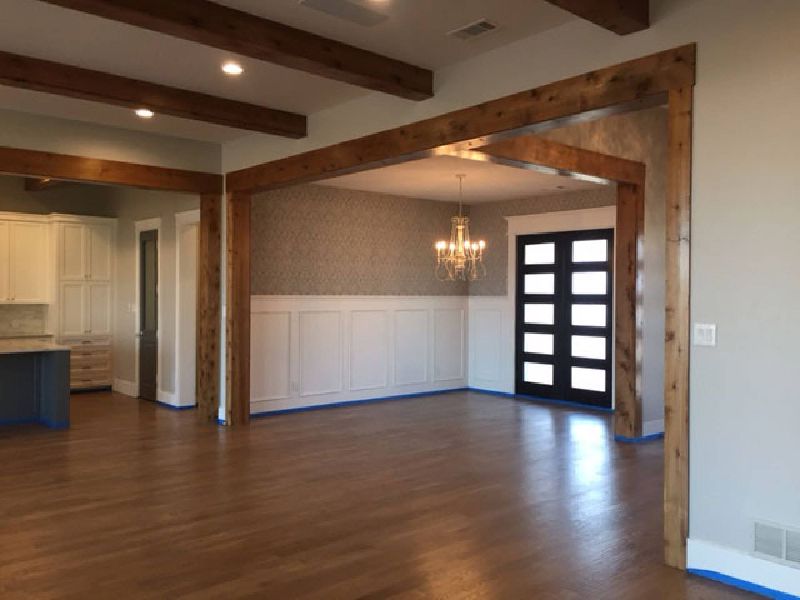
Find the location of a particular element. The height and width of the screenshot is (600, 800). wallpaper is located at coordinates (325, 257).